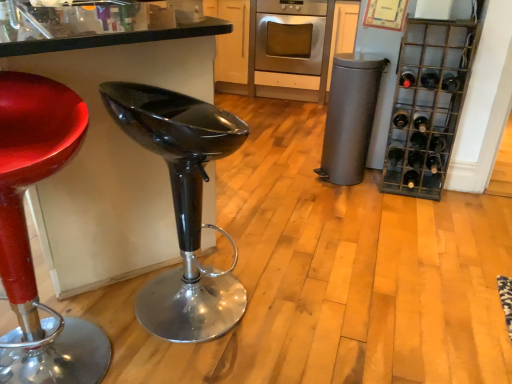
Locate an element on the screen. The image size is (512, 384). free space to the right of metallic wine rack at right is located at coordinates (468, 202).